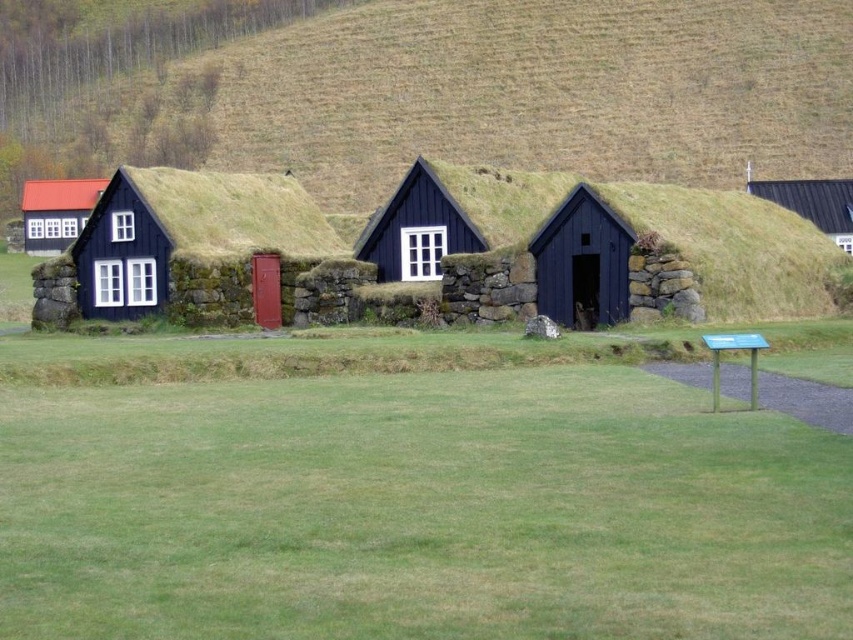
You are standing in the grassy field in front of the turf houses. You see two points marked in the image. The first point is at coordinate point (x=293, y=205) and the second point is at coordinate point (x=538, y=244). Which point is closer to you?

Point (x=293, y=205) is closer to you because it is further to the camera than point (x=538, y=244).